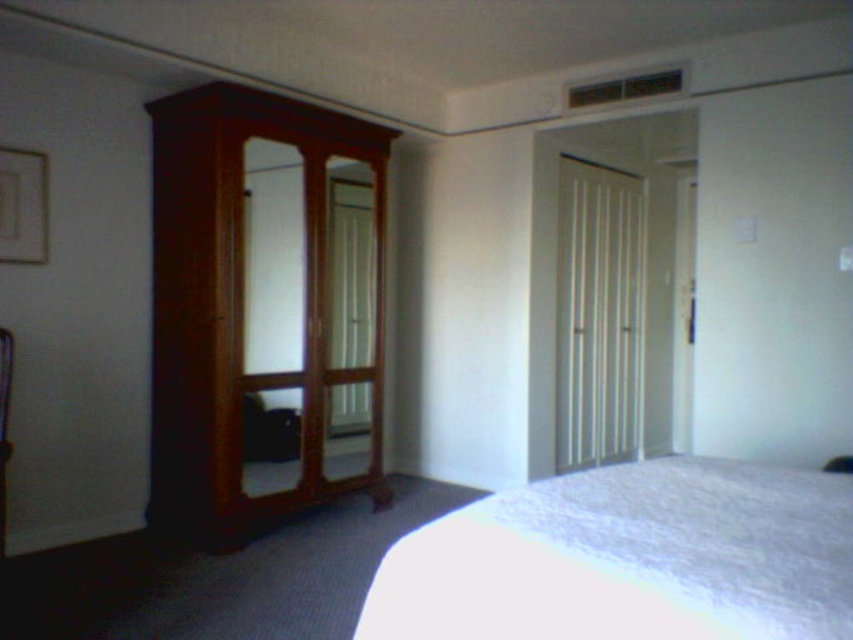
You are standing in the bedroom and want to move from the wooden mirror at left to the white fluffy bed at lower right. Which direction should you walk to reach the bed without passing behind the mirror?

The white fluffy bed at lower right is in front of the wooden mirror at left, so you should walk forward towards the bed from the mirror to avoid going behind it.